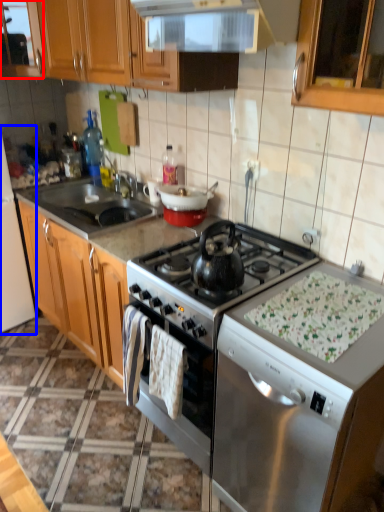
Question: Which of the following is the closest to the observer, cabinetry (highlighted by a red box) or appliance (highlighted by a blue box)?

Choices:
 (A) cabinetry
 (B) appliance

Answer: (B)